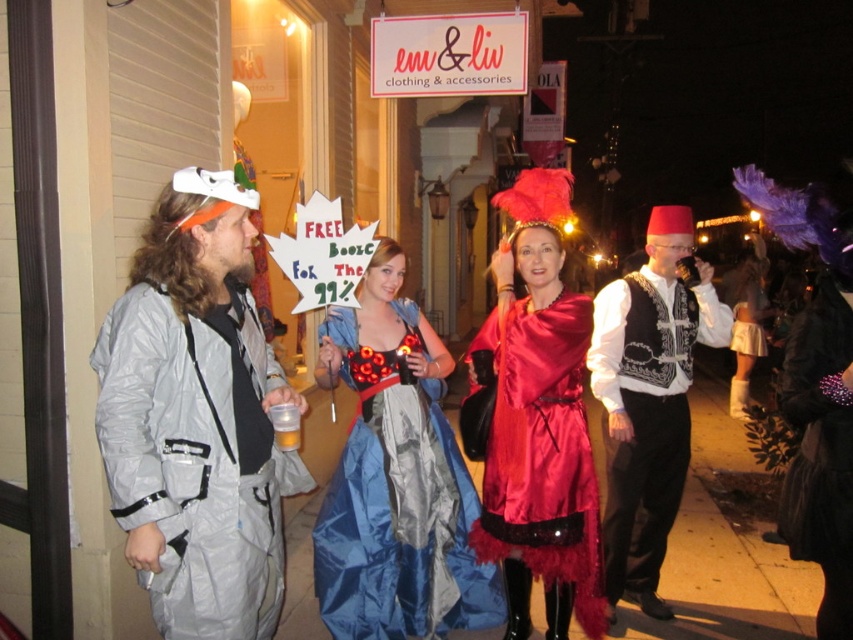
Is white satin dress at center below translucent plastic cup at lower left?

No.

Can you confirm if white satin dress at center is wider than translucent plastic cup at lower left?

Yes, white satin dress at center is wider than translucent plastic cup at lower left.

Between point (759, 340) and point (270, 406), which one is positioned in front?

Point (270, 406)

The height and width of the screenshot is (640, 853). Find the location of `white satin dress at center`. white satin dress at center is located at coordinates (747, 320).

Who is higher up, silver metallic jumpsuit at left or blue satin dress at center?

silver metallic jumpsuit at left is higher up.

Between silver metallic jumpsuit at left and blue satin dress at center, which one appears on the left side from the viewer's perspective?

From the viewer's perspective, silver metallic jumpsuit at left appears more on the left side.

Does point (136, 483) lie behind point (482, 600)?

No, (136, 483) is in front of (482, 600).

Image resolution: width=853 pixels, height=640 pixels. I want to click on silver metallic jumpsuit at left, so click(196, 419).

Between silver metallic jumpsuit at left and white satin dress at center, which one is positioned higher?

white satin dress at center is above.

Who is lower down, silver metallic jumpsuit at left or white satin dress at center?

Positioned lower is silver metallic jumpsuit at left.

The width and height of the screenshot is (853, 640). Find the location of `silver metallic jumpsuit at left`. silver metallic jumpsuit at left is located at coordinates (196, 419).

Find the location of `silver metallic jumpsuit at left`. silver metallic jumpsuit at left is located at coordinates (196, 419).